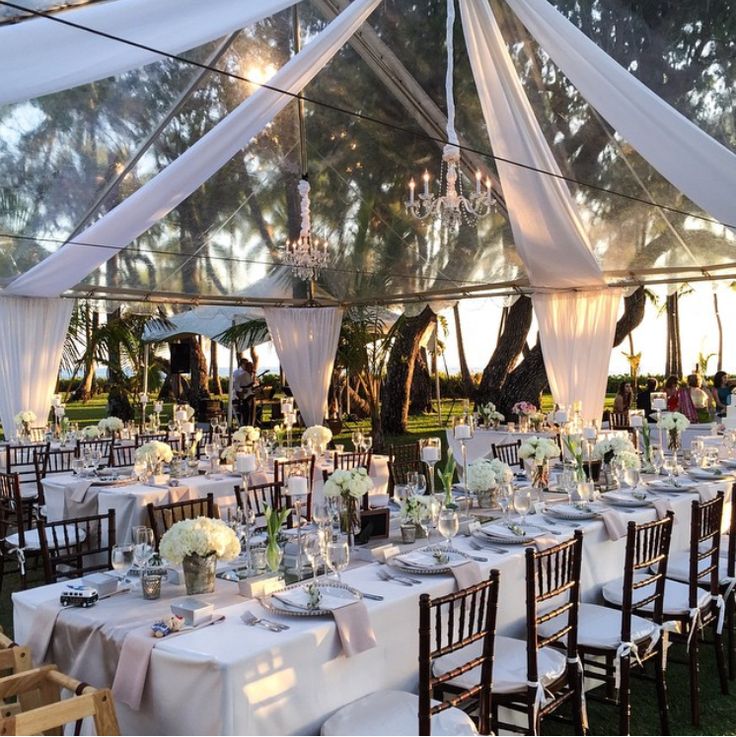
You are a GUI agent. You are given a task and a screenshot of the screen. Output one action in this format:
    pyautogui.click(x=<x>, y=<y>)
    Task: Click on the chandelier bulbs
    This screenshot has width=736, height=737.
    Given the screenshot: What is the action you would take?
    pyautogui.click(x=285, y=234), pyautogui.click(x=294, y=242), pyautogui.click(x=302, y=237), pyautogui.click(x=308, y=237), pyautogui.click(x=319, y=241), pyautogui.click(x=328, y=245), pyautogui.click(x=411, y=181), pyautogui.click(x=425, y=178), pyautogui.click(x=473, y=172), pyautogui.click(x=491, y=177)